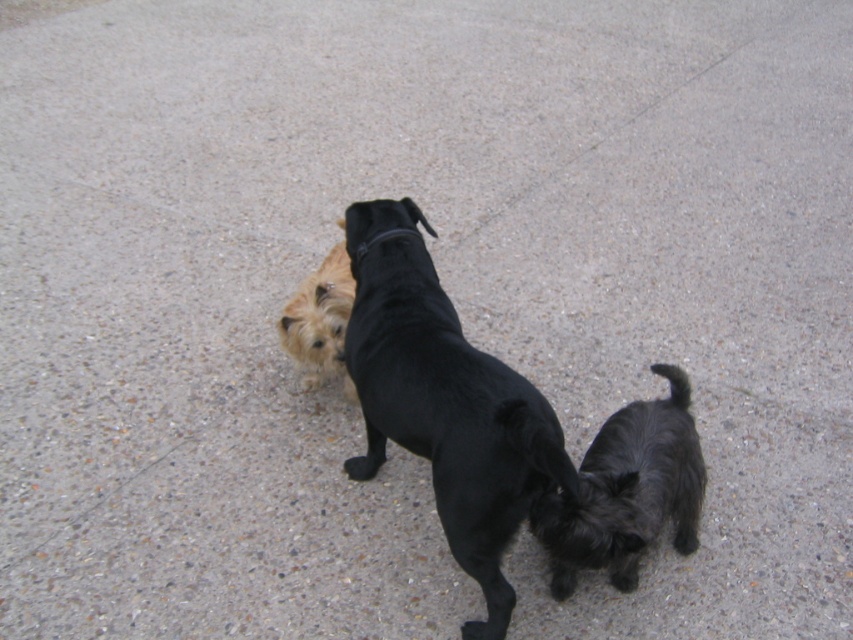
Question: Among these objects, which one is nearest to the camera?

Choices:
 (A) black leather neckband at center
 (B) shaggy black dog at lower right

Answer: (B)

Question: Which object is farther from the camera taking this photo?

Choices:
 (A) black leather neckband at center
 (B) black smooth dog at center
 (C) shaggy black dog at lower right
 (D) golden fur dog at center

Answer: (D)

Question: Which point is farther to the camera?

Choices:
 (A) black leather neckband at center
 (B) golden fur dog at center
 (C) black smooth dog at center

Answer: (B)

Question: Is shaggy black dog at lower right thinner than black leather neckband at center?

Choices:
 (A) yes
 (B) no

Answer: (B)

Question: Does shaggy black dog at lower right have a greater width compared to golden fur dog at center?

Choices:
 (A) yes
 (B) no

Answer: (A)

Question: Is shaggy black dog at lower right thinner than black leather neckband at center?

Choices:
 (A) no
 (B) yes

Answer: (A)